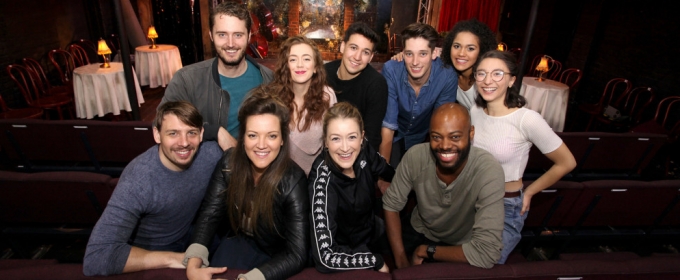
This screenshot has height=280, width=680. I want to click on tablecloth, so click(557, 102), click(166, 63), click(95, 87).